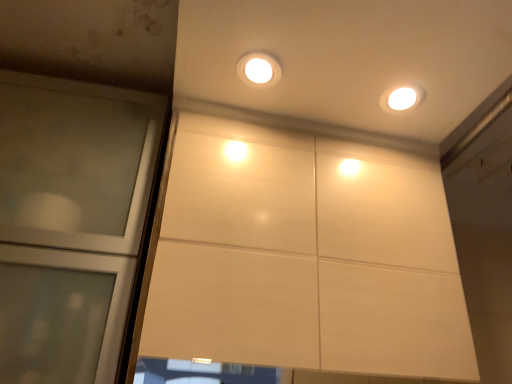
Locate an element on the screen. The image size is (512, 384). matte white light fixture at upper center is located at coordinates (258, 70).

Image resolution: width=512 pixels, height=384 pixels. Describe the element at coordinates (258, 70) in the screenshot. I see `matte white light fixture at upper center` at that location.

What do you see at coordinates (72, 213) in the screenshot? I see `transparent glass door at left` at bounding box center [72, 213].

This screenshot has width=512, height=384. I want to click on transparent glass door at left, so click(72, 213).

This screenshot has height=384, width=512. In order to click on matte white light fixture at upper center in this screenshot , I will do `click(258, 70)`.

Can you confirm if transparent glass door at left is positioned to the left of matte white light fixture at upper center?

Correct, you'll find transparent glass door at left to the left of matte white light fixture at upper center.

Relative to matte white light fixture at upper center, is transparent glass door at left in front or behind?

Visually, transparent glass door at left is located in front of matte white light fixture at upper center.

Is point (59, 178) positioned behind point (262, 70)?

Yes, point (59, 178) is behind point (262, 70).

From the image's perspective, is transparent glass door at left on matte white light fixture at upper center?

No, from the image's perspective, transparent glass door at left is not over matte white light fixture at upper center.

From a real-world perspective, is transparent glass door at left physically below matte white light fixture at upper center?

Yes, from a real-world perspective, transparent glass door at left is below matte white light fixture at upper center.

Which of these two, transparent glass door at left or matte white light fixture at upper center, is wider?

Wider between the two is transparent glass door at left.

Is transparent glass door at left taller or shorter than matte white light fixture at upper center?

transparent glass door at left is taller than matte white light fixture at upper center.

Which of these two, transparent glass door at left or matte white light fixture at upper center, is bigger?

Bigger between the two is transparent glass door at left.

Would you say transparent glass door at left contains matte white light fixture at upper center?

No, matte white light fixture at upper center is located outside of transparent glass door at left.

Is transparent glass door at left next to matte white light fixture at upper center?

No.

Is transparent glass door at left positioned with its back to matte white light fixture at upper center?

No, transparent glass door at left's orientation is not away from matte white light fixture at upper center.

How different are the orientations of transparent glass door at left and matte white light fixture at upper center in degrees?

The angle between the facing direction of transparent glass door at left and the facing direction of matte white light fixture at upper center is 3.21 degrees.

Locate an element on the screen. This screenshot has width=512, height=384. door on the left of matte white light fixture at upper center is located at coordinates (72, 213).

Looking at this image, considering the relative positions of matte white light fixture at upper center and transparent glass door at left in the image provided, is matte white light fixture at upper center to the right of transparent glass door at left from the viewer's perspective?

Yes, matte white light fixture at upper center is to the right of transparent glass door at left.

Relative to transparent glass door at left, is matte white light fixture at upper center in front or behind?

matte white light fixture at upper center is behind transparent glass door at left.

Does point (263, 83) come farther from viewer compared to point (49, 319)?

Yes, it is.

From the image's perspective, relative to transparent glass door at left, is matte white light fixture at upper center above or below?

matte white light fixture at upper center is situated higher than transparent glass door at left in the image.

From a real-world perspective, between matte white light fixture at upper center and transparent glass door at left, who is vertically higher?

matte white light fixture at upper center is physically above.

Is matte white light fixture at upper center thinner than transparent glass door at left?

Correct, the width of matte white light fixture at upper center is less than that of transparent glass door at left.

Who is taller, matte white light fixture at upper center or transparent glass door at left?

Standing taller between the two is transparent glass door at left.

Looking at this image, does matte white light fixture at upper center have a larger size compared to transparent glass door at left?

No.

Is matte white light fixture at upper center situated inside transparent glass door at left or outside?

matte white light fixture at upper center is not inside transparent glass door at left, it's outside.

Would you say matte white light fixture at upper center is a long distance from transparent glass door at left?

matte white light fixture at upper center is actually quite close to transparent glass door at left.

From the picture: Is matte white light fixture at upper center facing away from transparent glass door at left?

No, matte white light fixture at upper center's orientation is not away from transparent glass door at left.

How many degrees apart are the facing directions of matte white light fixture at upper center and transparent glass door at left?

3.21 degrees.

How far apart are matte white light fixture at upper center and transparent glass door at left?

16.90 inches.

Where is `door in front of the matte white light fixture at upper center`? door in front of the matte white light fixture at upper center is located at coordinates (72, 213).

Locate an element on the screen. The image size is (512, 384). door that is in front of the matte white light fixture at upper center is located at coordinates (72, 213).

This screenshot has height=384, width=512. I want to click on dot above the transparent glass door at left (from a real-world perspective), so coord(258,70).